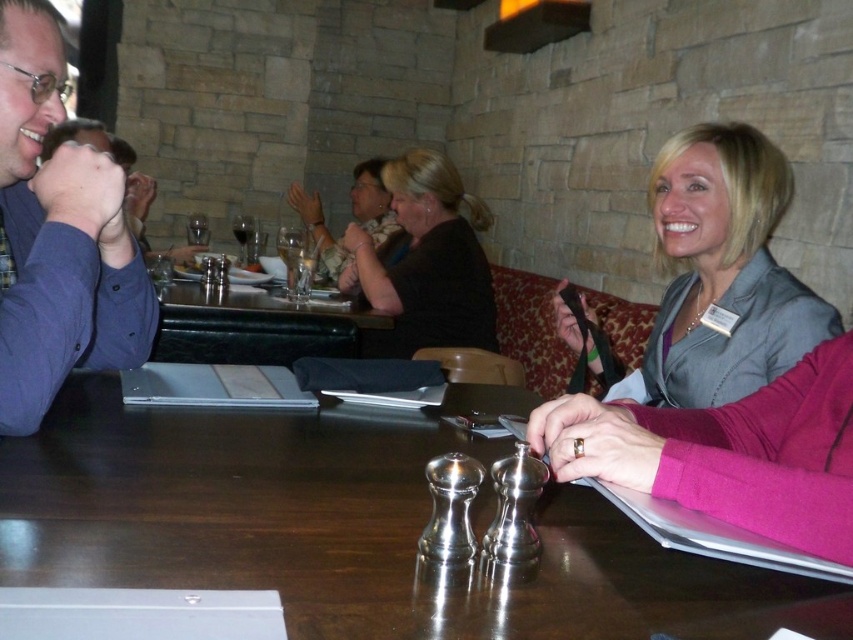
Question: Estimate the real-world distances between objects in this image. Which object is farther from the gray fabric jacket at upper right?

Choices:
 (A) blue fabric shirt at left
 (B) metallic silver salt and pepper shakers at center
 (C) transparent glass at upper center

Answer: (C)

Question: Which object is the closest to the transparent glass at upper center?

Choices:
 (A) blue fabric shirt at left
 (B) metallic silver salt and pepper shakers at center
 (C) wooden table at center
 (D) gray fabric jacket at upper right

Answer: (C)

Question: Can you confirm if metallic silver salt and pepper shakers at center is positioned to the right of transparent glass wine glass at upper center?

Choices:
 (A) no
 (B) yes

Answer: (B)

Question: Estimate the real-world distances between objects in this image. Which object is farther from the clear glass wine glass at center?

Choices:
 (A) matte black jacket at upper center
 (B) blue fabric shirt at left
 (C) wooden table at center

Answer: (B)

Question: Does blue fabric shirt at left have a larger size compared to matte black jacket at upper center?

Choices:
 (A) no
 (B) yes

Answer: (A)

Question: Is transparent glass at upper center closer to camera compared to transparent glass wine glass at upper center?

Choices:
 (A) yes
 (B) no

Answer: (B)